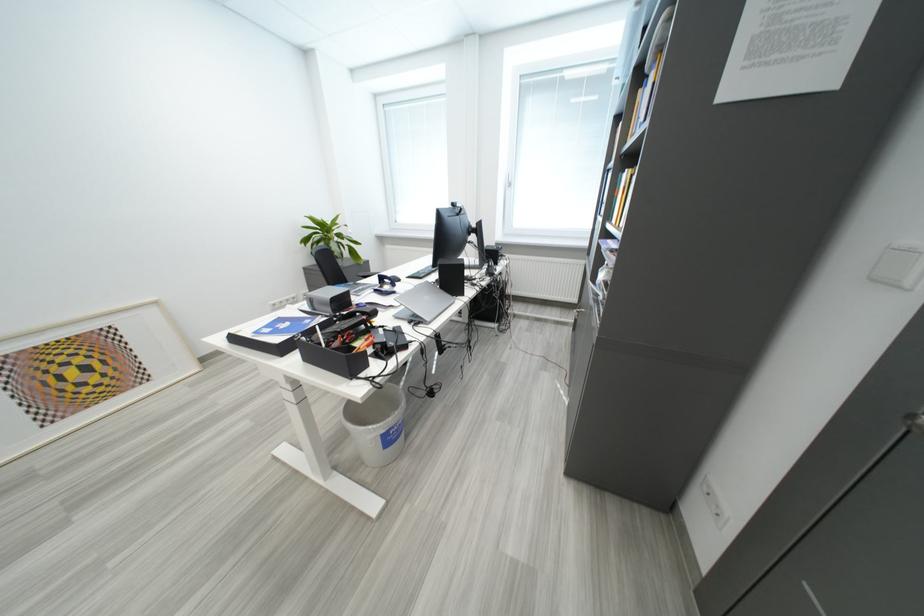
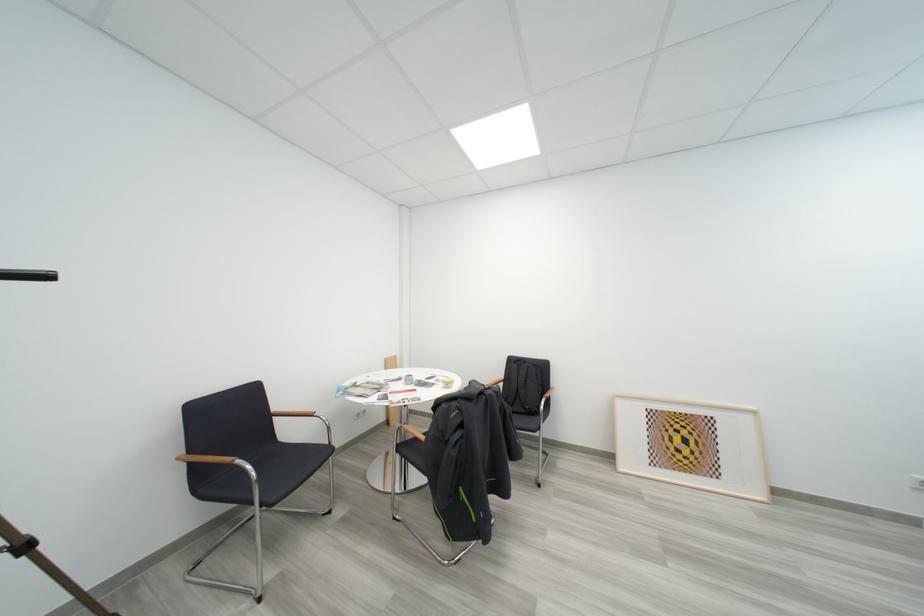
Where in the second image is the point corresponding to the point at 88,363 from the first image?

(693, 435)